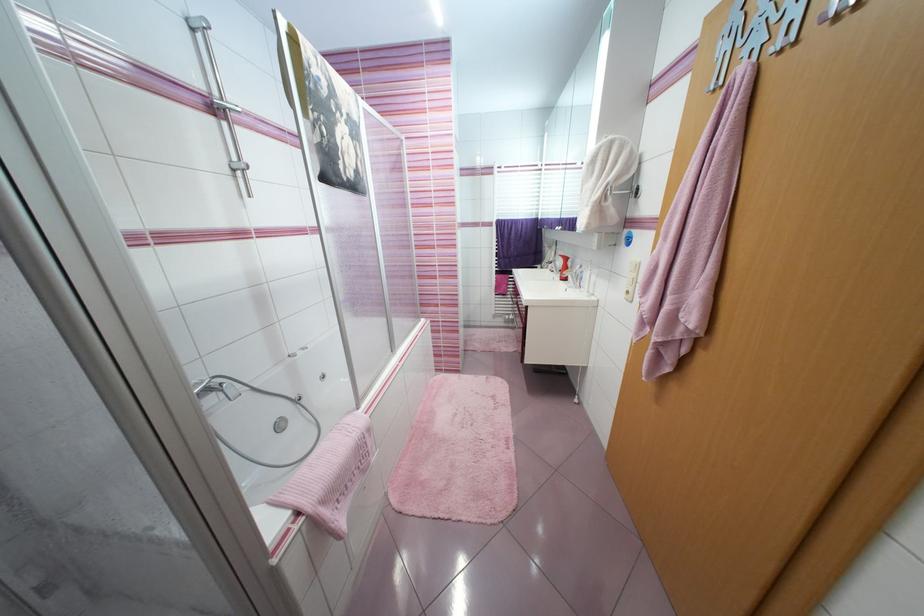
The width and height of the screenshot is (924, 616). Find the location of `faucet diverter knob`. faucet diverter knob is located at coordinates (280, 424).